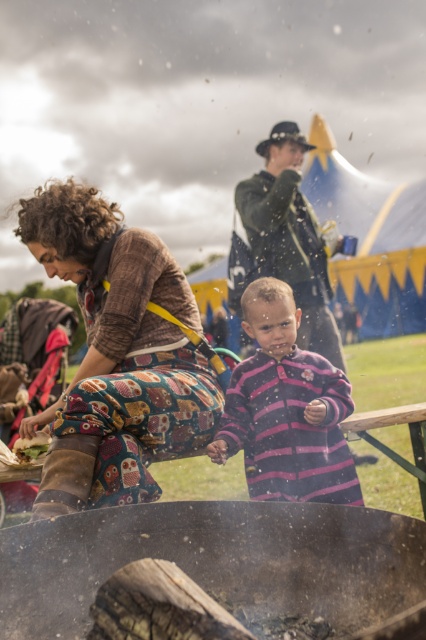
Is printed fabric pants at center below pink striped sweater at center?

Actually, printed fabric pants at center is above pink striped sweater at center.

At what (x,y) coordinates should I click in order to perform the action: click on printed fabric pants at center. Please return your answer as a coordinate pair (x, y). This screenshot has width=426, height=640. Looking at the image, I should click on (117, 355).

Is point (78, 218) positioned behind point (324, 490)?

Yes, it is behind point (324, 490).

I want to click on printed fabric pants at center, so click(x=117, y=355).

Does pink striped sweater at center have a lesser width compared to green fabric hat at upper center?

Indeed, pink striped sweater at center has a lesser width compared to green fabric hat at upper center.

In the scene shown: Does pink striped sweater at center lie behind green fabric hat at upper center?

That is False.

Between point (265, 324) and point (255, 173), which one is positioned in front?

Point (265, 324)

Locate an element on the screen. pink striped sweater at center is located at coordinates [x=285, y=410].

Which is in front, point (40, 625) or point (23, 461)?

Positioned in front is point (40, 625).

Who is taller, charcoal black wood at lower center or grilled bread at lower left?

With more height is charcoal black wood at lower center.

Where is `charcoal black wood at lower center`? Image resolution: width=426 pixels, height=640 pixels. charcoal black wood at lower center is located at coordinates point(224,564).